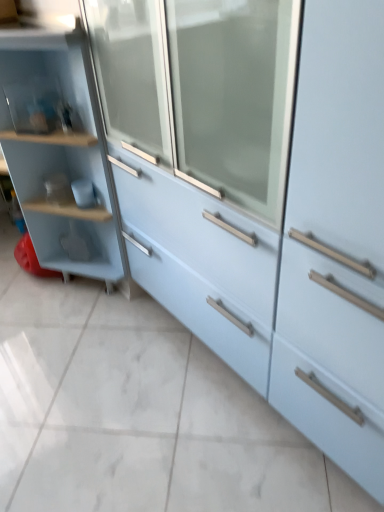
Locate an element on the screen. This screenshot has height=512, width=384. matte white shelf at left is located at coordinates (59, 152).

What is the approximate height of matte white shelf at left?

matte white shelf at left is 1.08 meters in height.

Describe the element at coordinates (59, 152) in the screenshot. I see `matte white shelf at left` at that location.

At what (x,y) coordinates should I click in order to perform the action: click on matte white shelf at left. Please return your answer as a coordinate pair (x, y). Looking at the image, I should click on (59, 152).